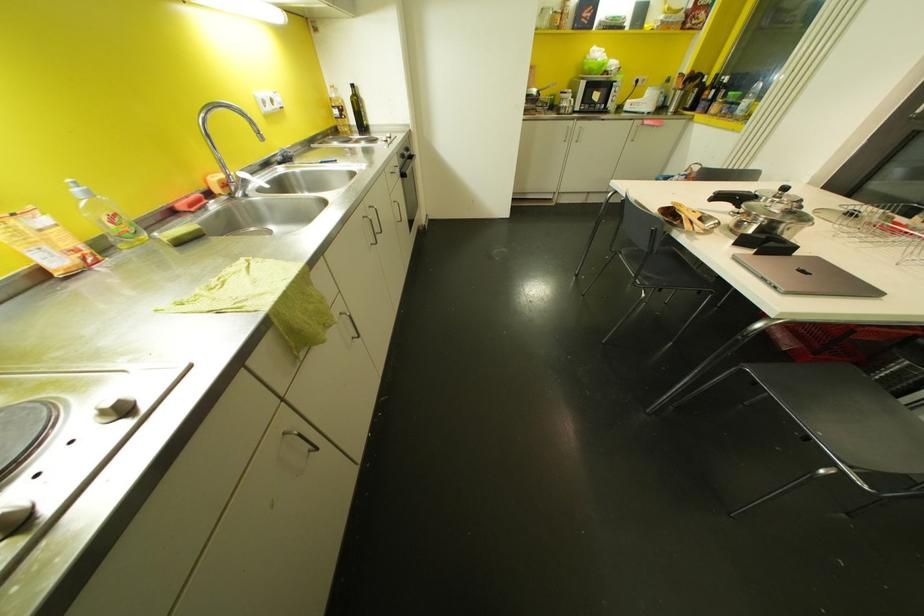
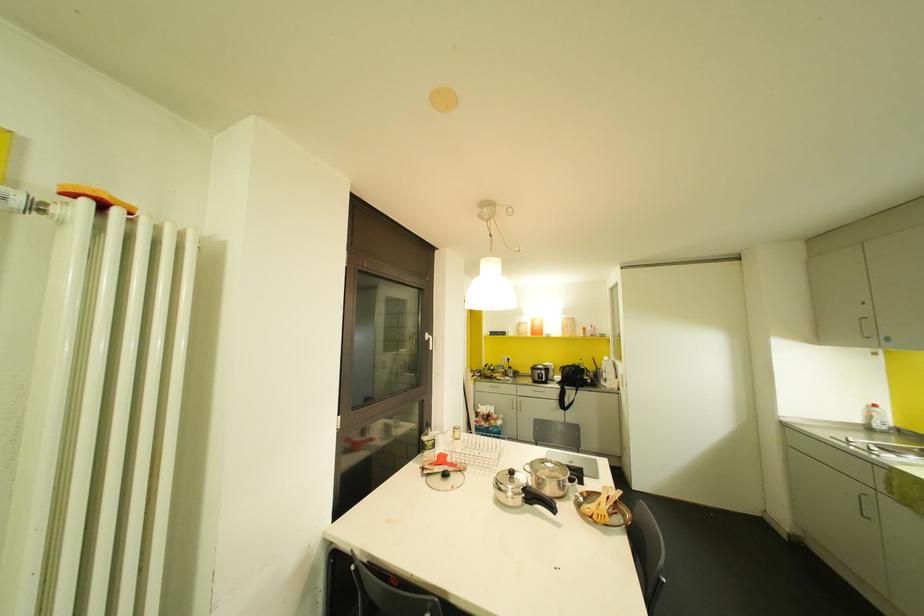
Question: I am providing you with two images of the same scene from different viewpoints. Please identify which objects are invisible in image2.

Choices:
 (A) glass bottle
 (B) wooden utensil
 (C) purple teddy bear
 (D) chair sitting surface

Answer: (D)